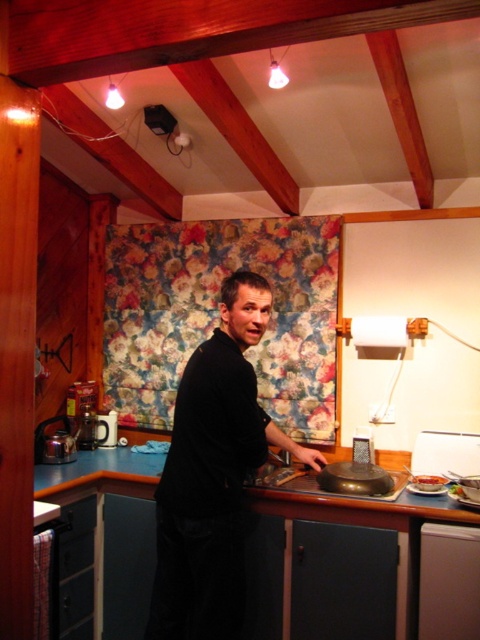
Question: Estimate the real-world distances between objects in this image. Which object is closer to the black matte shirt at center?

Choices:
 (A) white glossy plate at lower right
 (B) slightly browned bread at lower right

Answer: (B)

Question: Which object is positioned closest to the black matte shirt at center?

Choices:
 (A) slightly browned bread at lower right
 (B) white glossy plate at lower right

Answer: (A)

Question: Is slightly browned bread at lower right positioned in front of white glossy plate at lower right?

Choices:
 (A) yes
 (B) no

Answer: (B)

Question: Can you confirm if black matte shirt at center is positioned to the right of slightly browned bread at lower right?

Choices:
 (A) yes
 (B) no

Answer: (B)

Question: Which of the following is the farthest from the observer?

Choices:
 (A) (427, 486)
 (B) (432, 493)

Answer: (A)

Question: Is black matte shirt at center smaller than slightly browned bread at lower right?

Choices:
 (A) yes
 (B) no

Answer: (B)